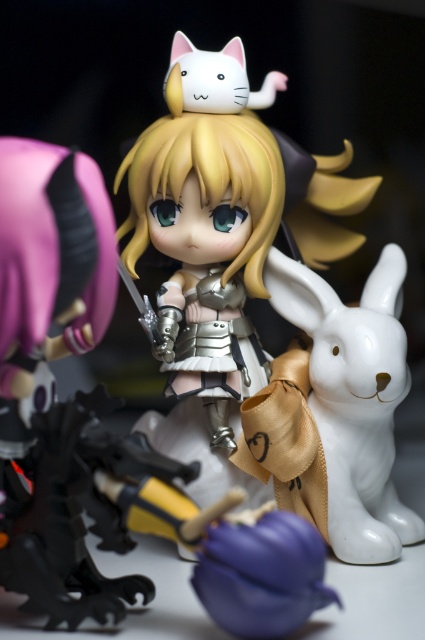
Question: Can you confirm if satin gold armor at center is positioned below white glossy rabbit at right?

Choices:
 (A) no
 (B) yes

Answer: (A)

Question: Does satin gold armor at center have a greater width compared to white glossy rabbit at right?

Choices:
 (A) no
 (B) yes

Answer: (B)

Question: Does satin gold armor at center have a greater width compared to white glossy rabbit at right?

Choices:
 (A) no
 (B) yes

Answer: (B)

Question: Which of the following is the farthest from the observer?

Choices:
 (A) white glossy rabbit at right
 (B) satin gold armor at center

Answer: (B)

Question: Which object is farther from the camera taking this photo?

Choices:
 (A) white glossy rabbit at right
 (B) satin gold armor at center

Answer: (B)